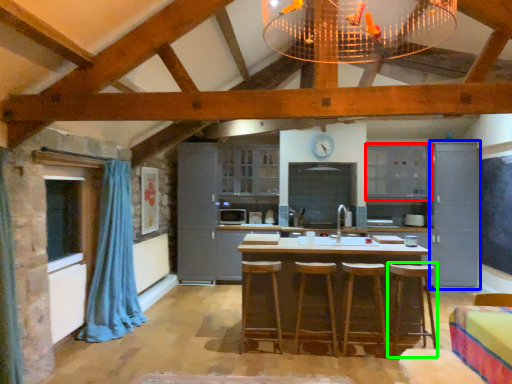
Question: Which object is positioned farthest from cabinetry (highlighted by a red box)? Select from cabinetry (highlighted by a blue box) and bar stool (highlighted by a green box).

Choices:
 (A) cabinetry
 (B) bar stool

Answer: (B)